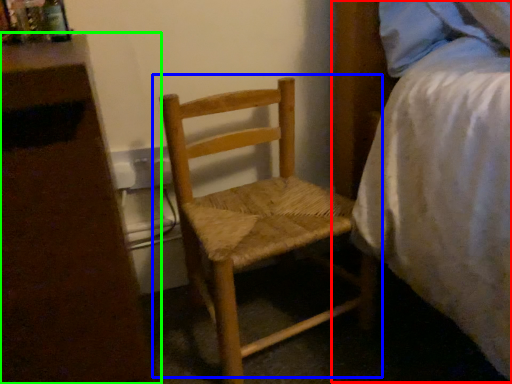
Question: Which object is the closest to the bed (highlighted by a red box)? Choose among these: chair (highlighted by a blue box) or nightstand (highlighted by a green box).

Choices:
 (A) chair
 (B) nightstand

Answer: (A)